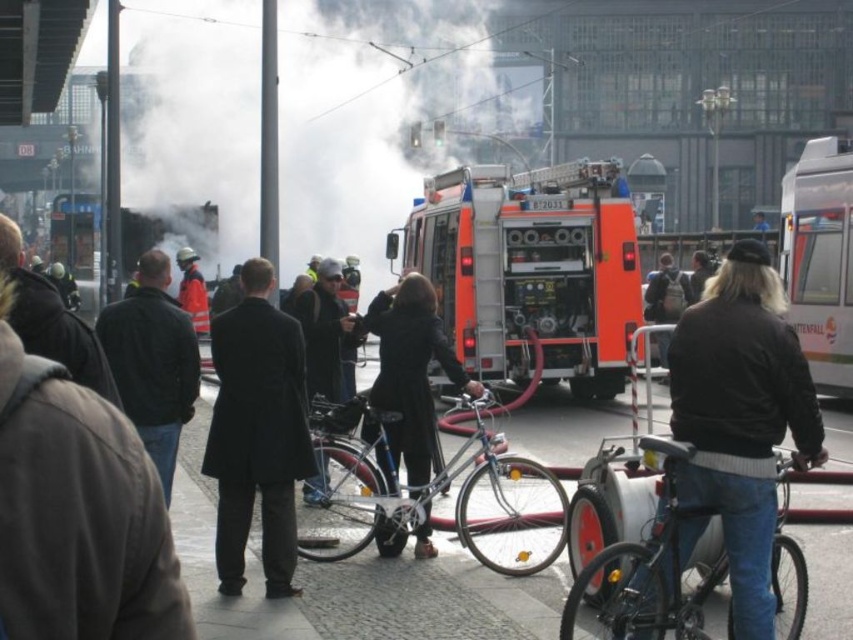
Question: Considering the real-world distances, which object is closest to the shiny metallic bicycle at center?

Choices:
 (A) dark brown leather jacket at center right
 (B) brown wool coat at center
 (C) dark gray coat at left
 (D) black matte coat at center

Answer: (D)

Question: In this image, where is brown wool coat at center located relative to dark brown leather jacket at left?

Choices:
 (A) below
 (B) above

Answer: (A)

Question: Among these points, which one is nearest to the camera?

Choices:
 (A) (119, 630)
 (B) (746, 637)

Answer: (A)

Question: Does orange matte fire truck at center have a larger size compared to dark brown leather jacket at left?

Choices:
 (A) yes
 (B) no

Answer: (A)

Question: Where is black smoke at left located in relation to black wool coat at center in the image?

Choices:
 (A) left
 (B) right

Answer: (A)

Question: Which point is closer to the camera taking this photo?

Choices:
 (A) (343, 394)
 (B) (250, 176)
 (C) (607, 589)
 (D) (486, 467)

Answer: (C)